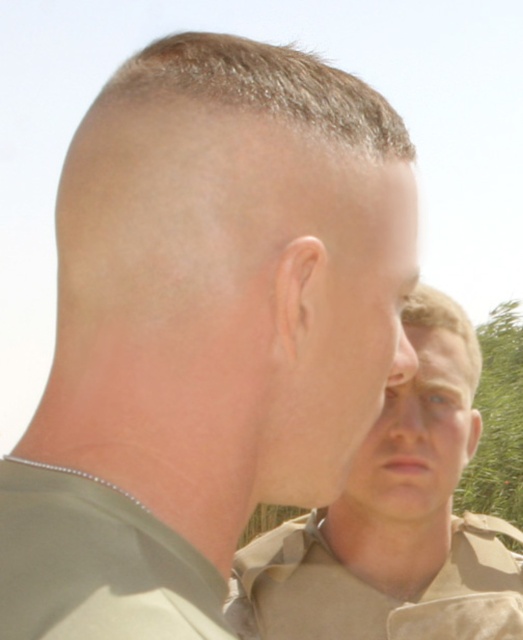
The image size is (523, 640). Find the location of `tan uniform at center`. tan uniform at center is located at coordinates (394, 520).

This screenshot has height=640, width=523. Describe the element at coordinates (394, 520) in the screenshot. I see `tan uniform at center` at that location.

Locate an element on the screen. The image size is (523, 640). tan uniform at center is located at coordinates (394, 520).